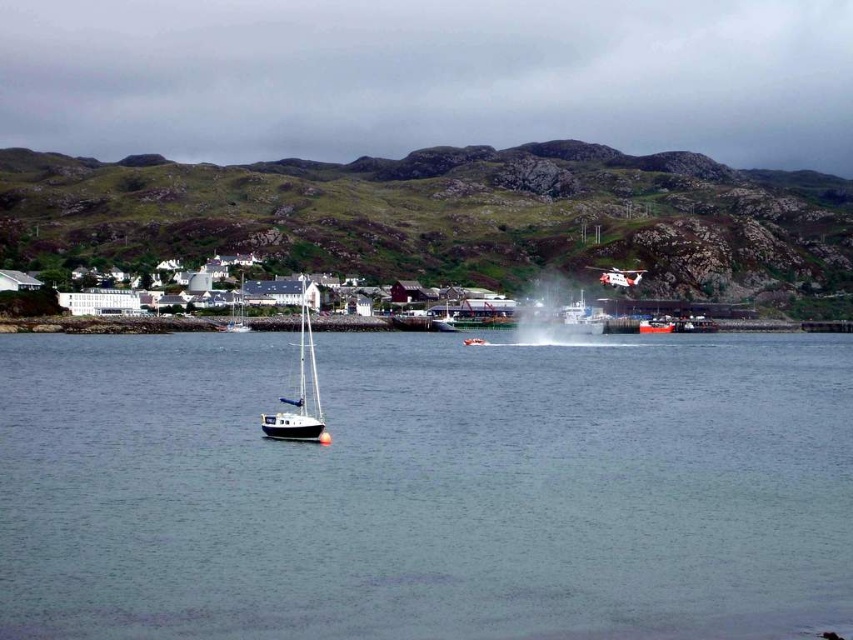
Can you confirm if clear water at center is taller than red glossy boat at center?

Indeed, clear water at center has a greater height compared to red glossy boat at center.

Is clear water at center in front of red glossy boat at center?

Yes, clear water at center is closer to the viewer.

Where is `clear water at center`? clear water at center is located at coordinates (426, 488).

Locate an element on the screen. This screenshot has height=640, width=853. clear water at center is located at coordinates (426, 488).

Which is in front, point (651, 326) or point (485, 339)?

Point (485, 339) is in front.

The image size is (853, 640). Find the location of `red glossy boat at center`. red glossy boat at center is located at coordinates (654, 324).

Who is more distant from viewer, (329, 600) or (310, 397)?

The point (310, 397) is more distant.

Where is `clear water at center`? The image size is (853, 640). clear water at center is located at coordinates (426, 488).